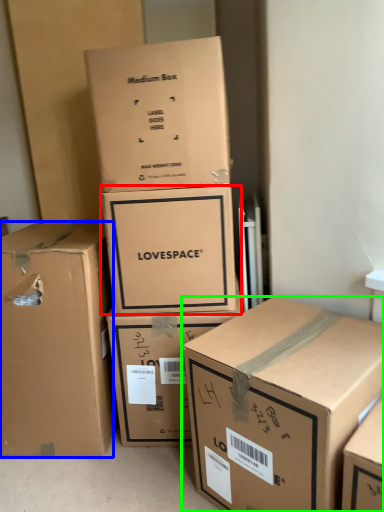
Question: Based on their relative distances, which object is nearer to box (highlighted by a red box)? Choose from box (highlighted by a blue box) and box (highlighted by a green box).

Choices:
 (A) box
 (B) box

Answer: (A)